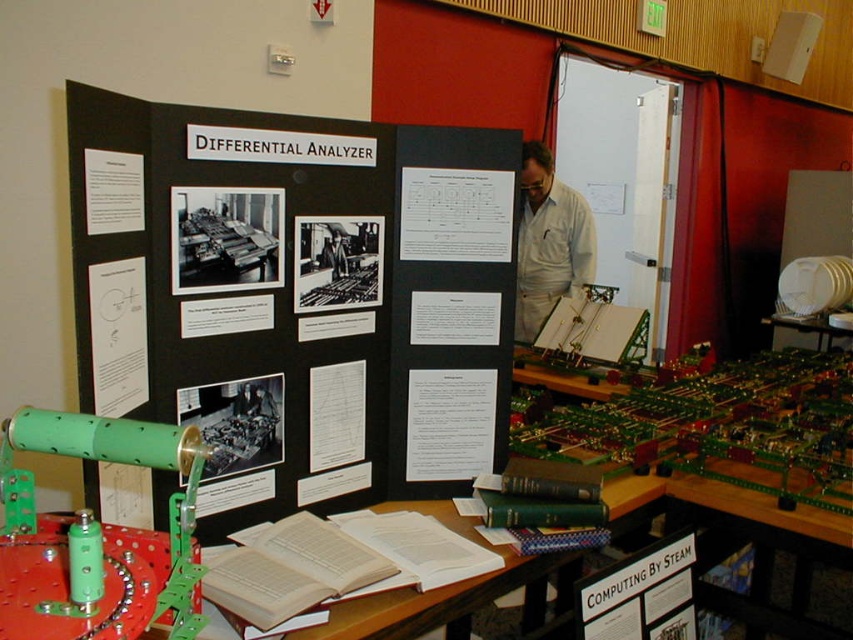
Is point (258, 611) farther from camera compared to point (558, 250)?

That is False.

Consider the image. Who is positioned more to the right, white paper book at center or white fabric shirt at center?

Positioned to the right is white fabric shirt at center.

Is point (350, 582) farther from viewer compared to point (570, 244)?

No.

Locate an element on the screen. The height and width of the screenshot is (640, 853). white paper book at center is located at coordinates (289, 570).

Does white paper book at center come in front of black paperboard at center?

Yes.

Which is behind, point (271, 579) or point (227, 232)?

The point (227, 232) is more distant.

Between point (270, 624) and point (206, 196), which one is positioned in front?

Point (270, 624) is in front.

Where is `white paper book at center`? This screenshot has width=853, height=640. white paper book at center is located at coordinates (289, 570).

Does white paper at center have a greater height compared to white paper at upper left?

Correct, white paper at center is much taller as white paper at upper left.

Which of these two, white paper at center or white paper at upper left, stands taller?

With more height is white paper at center.

You are a GUI agent. You are given a task and a screenshot of the screen. Output one action in this format:
    pyautogui.click(x=<x>, y=<y>)
    Task: Click on the white paper at center
    The width and height of the screenshot is (853, 640).
    Given the screenshot: What is the action you would take?
    pyautogui.click(x=456, y=214)

This screenshot has width=853, height=640. I want to click on white paper at center, so click(x=456, y=214).